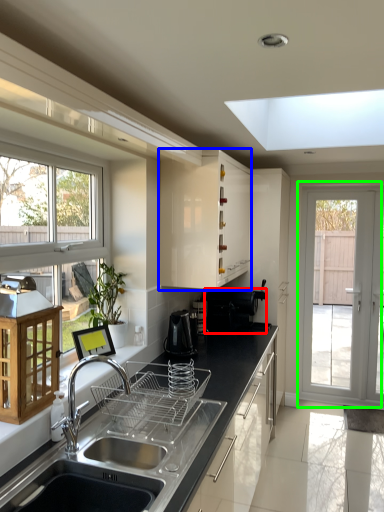
Question: Which is nearer to the appliance (highlighted by a red box)? cabinetry (highlighted by a blue box) or door (highlighted by a green box).

Choices:
 (A) cabinetry
 (B) door

Answer: (A)